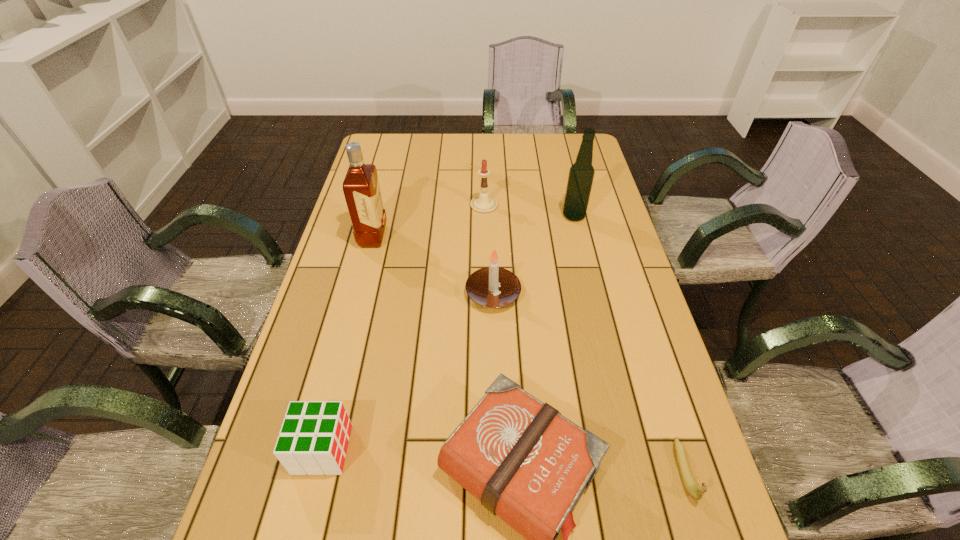
Identify the location of liquor. (361, 188).

Where is `the sixth object from left to right`? Image resolution: width=960 pixels, height=540 pixels. the sixth object from left to right is located at coordinates (581, 174).

Image resolution: width=960 pixels, height=540 pixels. In order to click on the farther candle in this screenshot , I will do `click(483, 203)`.

The width and height of the screenshot is (960, 540). Identify the location of the nearer candle. (493, 286).

I want to click on cube, so click(314, 436).

The image size is (960, 540). Identify the location of the rightmost object. (687, 478).

Locate an element on the screen. This screenshot has height=540, width=960. banana is located at coordinates (687, 478).

Where is `free space located 0.320m on the front label of the fifth nearest object`? This screenshot has width=960, height=540. free space located 0.320m on the front label of the fifth nearest object is located at coordinates 488,237.

Image resolution: width=960 pixels, height=540 pixels. I want to click on free region located 0.310m on the front of the sixth object from left to right, so click(592, 295).

Identify the location of vacant space located 0.150m on the right of the farther candle. (541, 205).